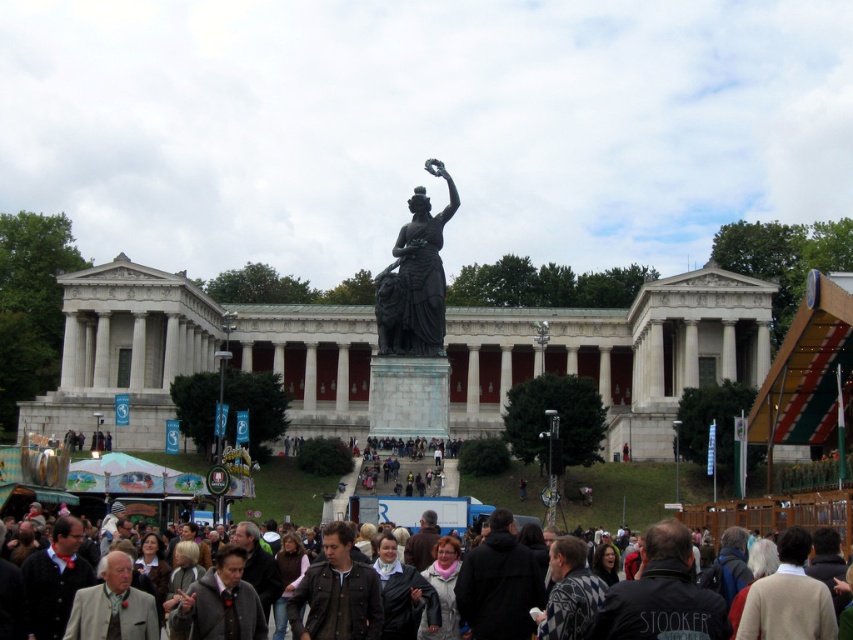
Is dark brown leather jacket at lower center below dark gray fabric crowd at center?

Correct, dark brown leather jacket at lower center is located below dark gray fabric crowd at center.

Who is shorter, dark brown leather jacket at lower center or dark gray fabric crowd at center?

With less height is dark gray fabric crowd at center.

Between point (16, 604) and point (450, 465), which one is positioned in front?

Point (16, 604) is more forward.

This screenshot has height=640, width=853. What are the coordinates of `dark brown leather jacket at lower center` in the screenshot? It's located at (814, 518).

Who is positioned more to the right, bronze statue at center or dark brown leather jacket at lower center?

dark brown leather jacket at lower center

Does bronze statue at center appear on the right side of dark brown leather jacket at lower center?

No, bronze statue at center is not to the right of dark brown leather jacket at lower center.

This screenshot has width=853, height=640. Describe the element at coordinates (415, 280) in the screenshot. I see `bronze statue at center` at that location.

The image size is (853, 640). I want to click on bronze statue at center, so click(x=415, y=280).

Based on the photo, is bronze statue at center below dark gray fabric crowd at center?

No, bronze statue at center is not below dark gray fabric crowd at center.

Does bronze statue at center lie behind dark gray fabric crowd at center?

Yes, bronze statue at center is further from the viewer.

Is point (448, 184) positioned behind point (357, 493)?

Yes, it is behind point (357, 493).

Where is `bronze statue at center`? This screenshot has height=640, width=853. bronze statue at center is located at coordinates (415, 280).